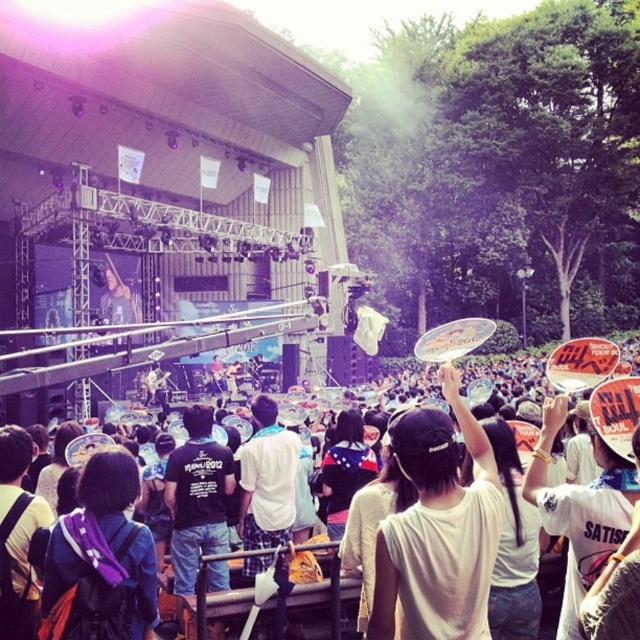
Is purple fabric backpack at center to the right of white cotton shirt at center from the viewer's perspective?

In fact, purple fabric backpack at center is to the left of white cotton shirt at center.

You are a GUI agent. You are given a task and a screenshot of the screen. Output one action in this format:
    pyautogui.click(x=<x>, y=<y>)
    Task: Click on the purple fabric backpack at center
    This screenshot has width=640, height=640.
    Given the screenshot: What is the action you would take?
    pyautogui.click(x=104, y=540)

Find the location of a particular element. purple fabric backpack at center is located at coordinates (104, 540).

Which is below, white matte t-shirt at center or purple fabric backpack at center?

purple fabric backpack at center is below.

Who is positioned more to the right, white matte t-shirt at center or purple fabric backpack at center?

white matte t-shirt at center is more to the right.

Which is behind, point (435, 515) or point (113, 536)?

The point (435, 515) is behind.

I want to click on white matte t-shirt at center, so [x=438, y=529].

Between point (67, 525) and point (472, 368), which one is positioned in front?

Positioned in front is point (67, 525).

Between purple fabric backpack at center and white plastic frisbee at upper center, which one has less height?

purple fabric backpack at center

The width and height of the screenshot is (640, 640). Identify the location of purple fabric backpack at center. (104, 540).